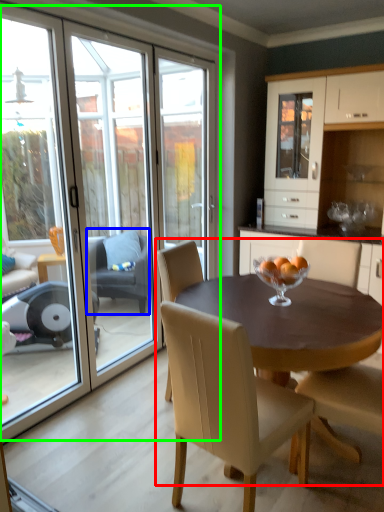
Question: Which object is the closest to the kitchen & dining room table (highlighted by a red box)? Choose among these: chair (highlighted by a blue box) or glass door (highlighted by a green box).

Choices:
 (A) chair
 (B) glass door

Answer: (B)